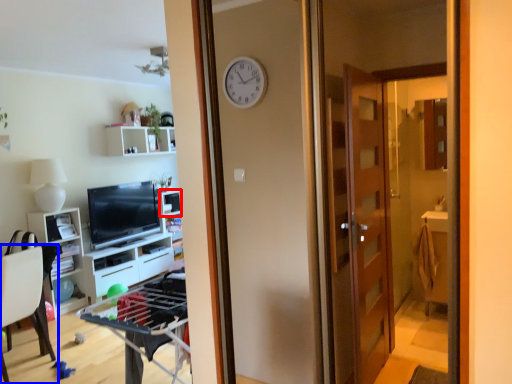
Question: Which point is closer to the camera, shelf (highlighted by a red box) or chair (highlighted by a blue box)?

Choices:
 (A) shelf
 (B) chair

Answer: (B)